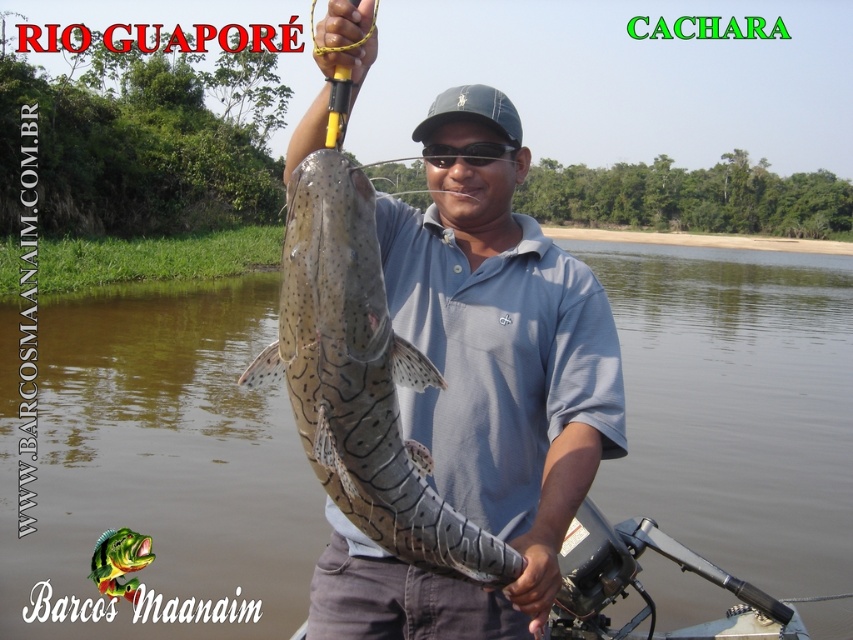
Question: Which object appears closest to the camera in this image?

Choices:
 (A) speckled skin catfish at center
 (B) brown water at center

Answer: (A)

Question: Among these points, which one is nearest to the camera?

Choices:
 (A) (550, 282)
 (B) (724, 376)

Answer: (A)

Question: Can you confirm if brown water at center is smaller than speckled skin catfish at center?

Choices:
 (A) no
 (B) yes

Answer: (A)

Question: Can you confirm if brown water at center is positioned below matte blue shirt at center?

Choices:
 (A) no
 (B) yes

Answer: (A)

Question: Which object is the closest to the matte blue shirt at center?

Choices:
 (A) speckled skin catfish at center
 (B) brown water at center

Answer: (A)

Question: Is the position of brown water at center more distant than that of matte blue shirt at center?

Choices:
 (A) no
 (B) yes

Answer: (B)